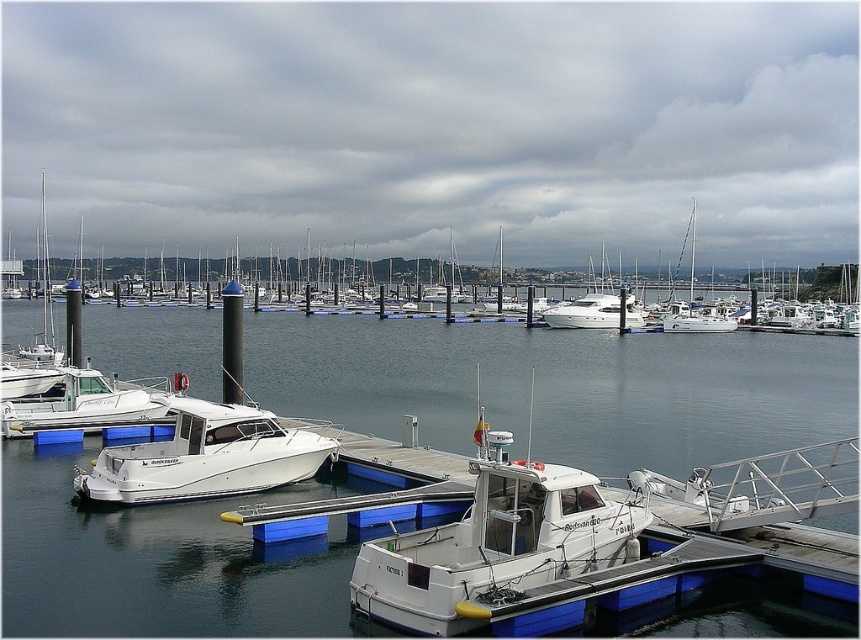
You are a dock worker who needs to stack some equipment on top of the boats. Given the height differences between the white matte boat at center and the white glossy boat at center, which boat would allow you to place taller equipment without exceeding its height?

The white matte boat at center has a greater height compared to the white glossy boat at center, so taller equipment can be placed on the white matte boat at center without exceeding its height.

You are a dock worker who needs to move a 6 meter long cargo container between the white matte boat at center and the white glossy boat at center. Can you fit the container between them without touching either boat?

The white matte boat at center and white glossy boat at center are 5.97 meters apart. Since the cargo container is 6 meters long, it cannot fit between them without touching the boats.